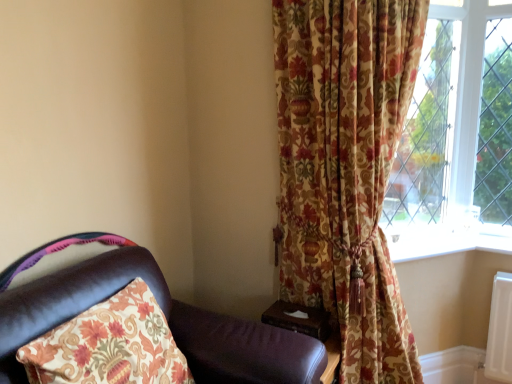
Question: Is wooden at right oriented towards leather chair at left?

Choices:
 (A) yes
 (B) no

Answer: (B)

Question: From the image's perspective, is wooden at right over leather chair at left?

Choices:
 (A) yes
 (B) no

Answer: (B)

Question: Is wooden at right outside leather chair at left?

Choices:
 (A) no
 (B) yes

Answer: (B)

Question: Can you confirm if wooden at right is wider than leather chair at left?

Choices:
 (A) no
 (B) yes

Answer: (A)

Question: Is wooden at right at the right side of leather chair at left?

Choices:
 (A) no
 (B) yes

Answer: (B)

Question: From a real-world perspective, is wooden at right on leather chair at left?

Choices:
 (A) no
 (B) yes

Answer: (A)

Question: Is leather chair at left turned away from wooden at right?

Choices:
 (A) no
 (B) yes

Answer: (A)

Question: From a real-world perspective, is leather chair at left on top of wooden at right?

Choices:
 (A) yes
 (B) no

Answer: (A)

Question: Is wooden at right located within leather chair at left?

Choices:
 (A) no
 (B) yes

Answer: (A)

Question: Is leather chair at left further to the viewer compared to wooden at right?

Choices:
 (A) yes
 (B) no

Answer: (B)

Question: From the image's perspective, is leather chair at left on wooden at right?

Choices:
 (A) yes
 (B) no

Answer: (A)

Question: Does leather chair at left have a greater height compared to wooden at right?

Choices:
 (A) yes
 (B) no

Answer: (A)

Question: Is white plastic window sill at lower right closer to camera compared to leather chair at left?

Choices:
 (A) no
 (B) yes

Answer: (A)